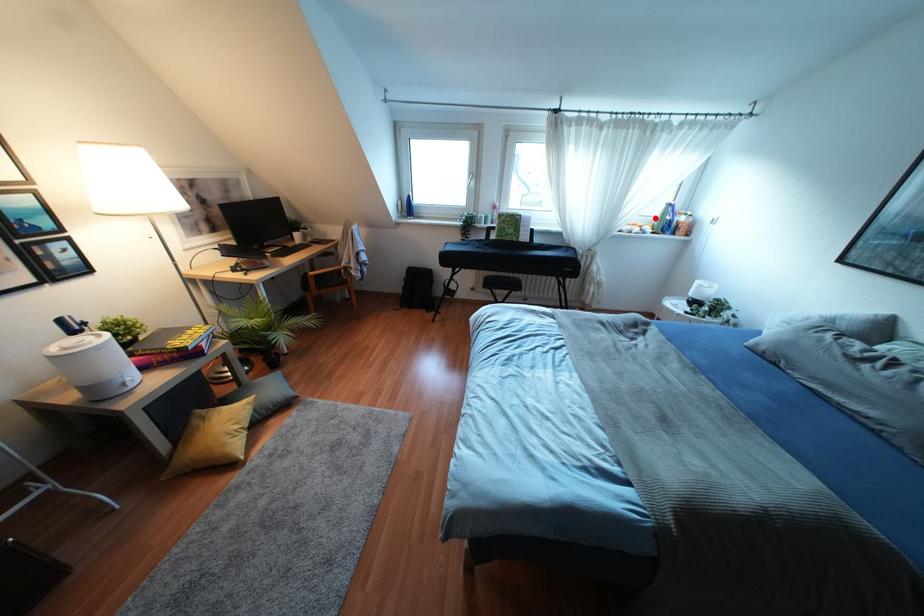
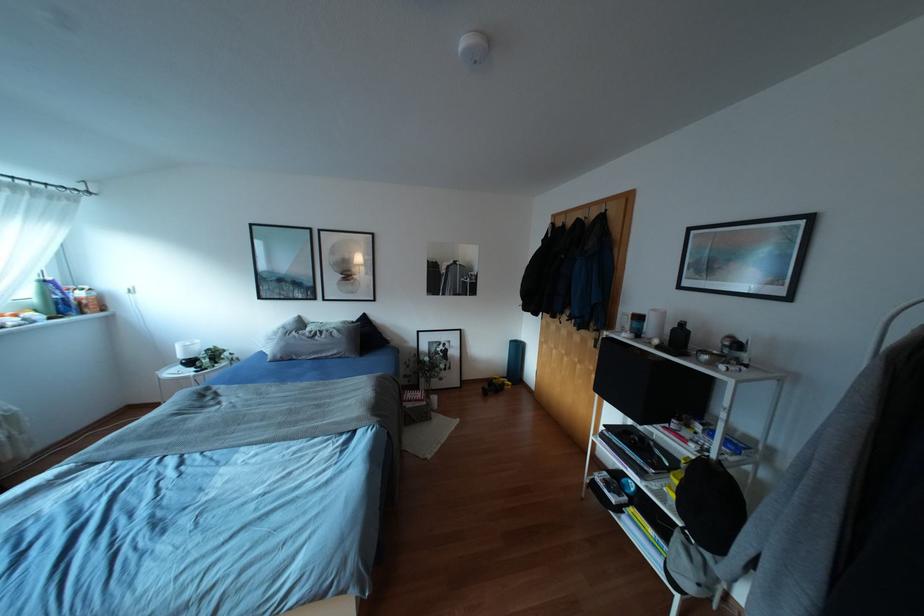
Question: I am providing you with two images of the same scene from different viewpoints. Image1 has a red point marked. In image2, the corresponding 3D location appears at what relative position? Reply with the corresponding letter.

Choices:
 (A) Closer
 (B) Farther

Answer: (B)